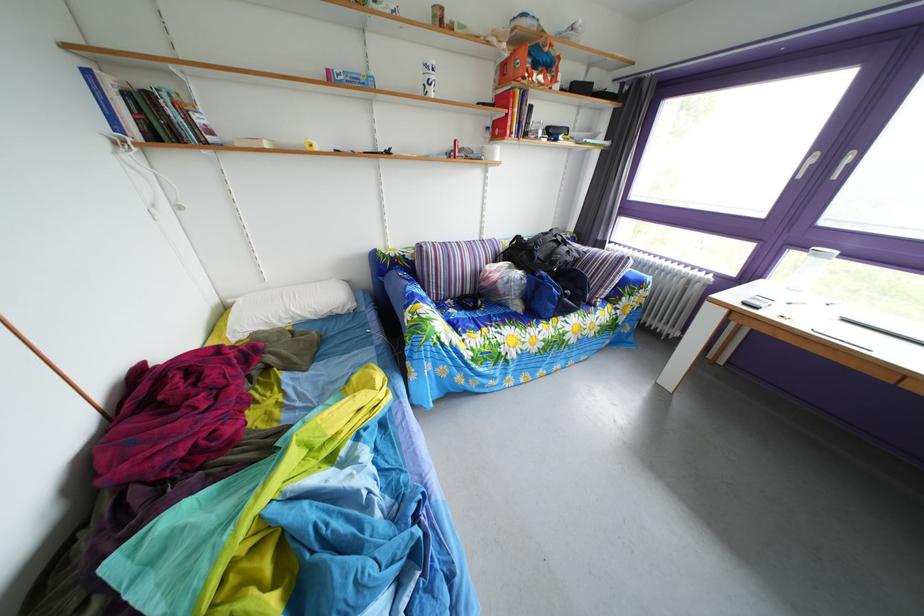
The height and width of the screenshot is (616, 924). What do you see at coordinates (420, 315) in the screenshot? I see `the striped sofa armrest` at bounding box center [420, 315].